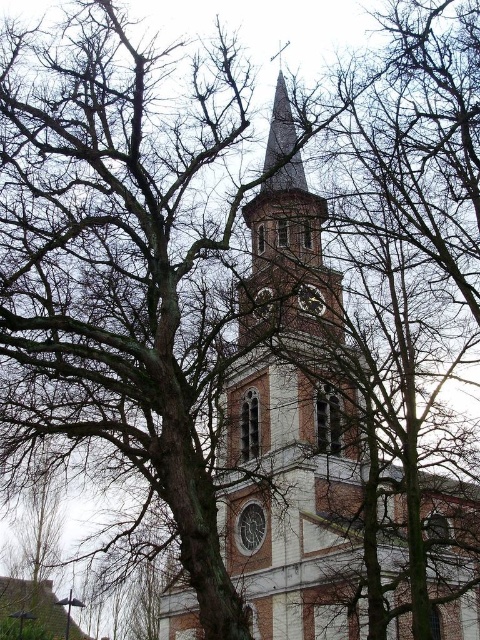
Question: Is metallic silver clock at center bigger than metallic clock at center?

Choices:
 (A) no
 (B) yes

Answer: (B)

Question: Where is metallic silver clock at center located in relation to metallic clock at center in the image?

Choices:
 (A) right
 (B) left

Answer: (A)

Question: Among these objects, which one is farthest from the camera?

Choices:
 (A) metallic clock at center
 (B) metallic silver clock at center

Answer: (B)

Question: Can you confirm if metallic silver clock at center is positioned below metallic clock at center?

Choices:
 (A) no
 (B) yes

Answer: (A)